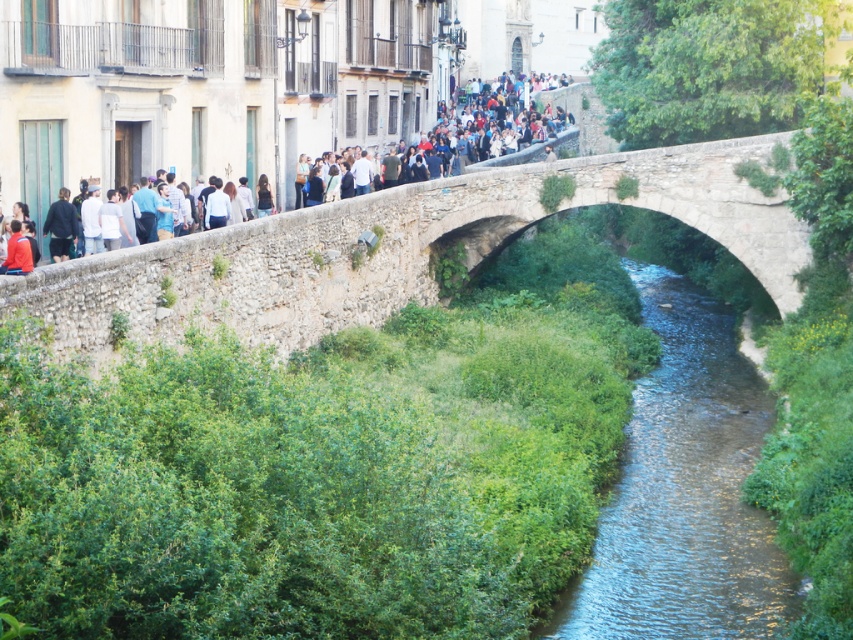
Question: Is stone arch bridge at upper center positioned in front of matte stone bridge at upper center?

Choices:
 (A) no
 (B) yes

Answer: (A)

Question: Is clear water stream at center below matte stone bridge at upper center?

Choices:
 (A) yes
 (B) no

Answer: (A)

Question: Does clear water stream at center appear over matte stone bridge at upper center?

Choices:
 (A) yes
 (B) no

Answer: (B)

Question: Which object is positioned closest to the stone arch bridge at upper center?

Choices:
 (A) clear water stream at center
 (B) matte stone bridge at upper center

Answer: (A)

Question: Which point appears closest to the camera in this image?

Choices:
 (A) (207, 118)
 (B) (492, 173)

Answer: (A)

Question: Which point appears farthest from the camera in this image?

Choices:
 (A) (440, 188)
 (B) (746, 531)
 (C) (247, 128)

Answer: (A)